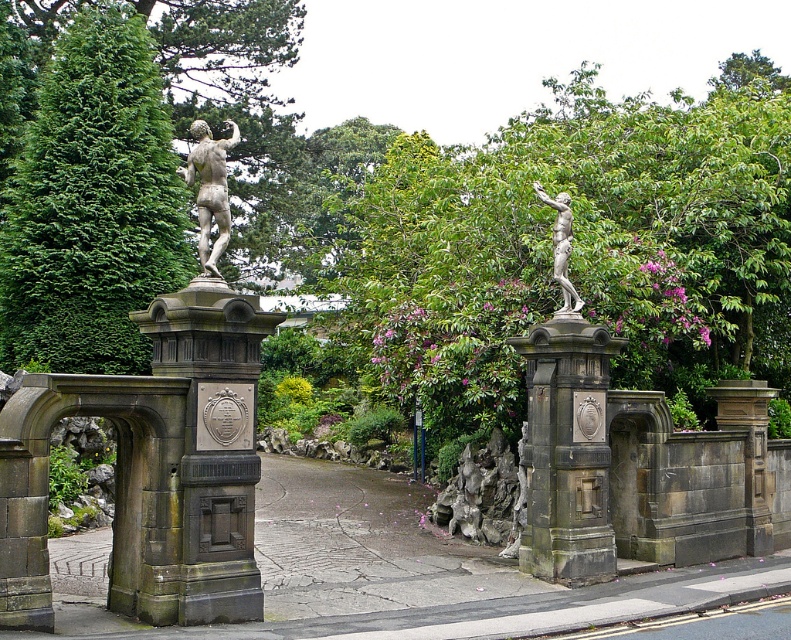
Question: Which object is positioned closest to the stone statue at center?

Choices:
 (A) green leafy tree at center
 (B) green leafy tree at left
 (C) bronze statue at upper center
 (D) polished bronze statue at upper left

Answer: (C)

Question: Which object appears farthest from the camera in this image?

Choices:
 (A) green leafy tree at center
 (B) dark gray stone gate at center

Answer: (A)

Question: Which object is positioned closest to the green leafy tree at center?

Choices:
 (A) dark gray stone gate at center
 (B) polished bronze statue at upper left
 (C) stone statue at center

Answer: (C)

Question: Is green leafy tree at left smaller than dark gray stone gate at center?

Choices:
 (A) no
 (B) yes

Answer: (A)

Question: Is green leafy tree at center above polished bronze statue at upper left?

Choices:
 (A) no
 (B) yes

Answer: (B)

Question: Can you confirm if green leafy tree at left is positioned above stone statue at center?

Choices:
 (A) yes
 (B) no

Answer: (A)